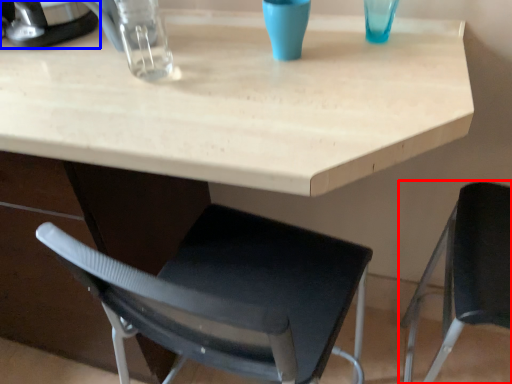
Question: Among these objects, which one is nearest to the camera, chair (highlighted by a red box) or appliance (highlighted by a blue box)?

Choices:
 (A) chair
 (B) appliance

Answer: (A)